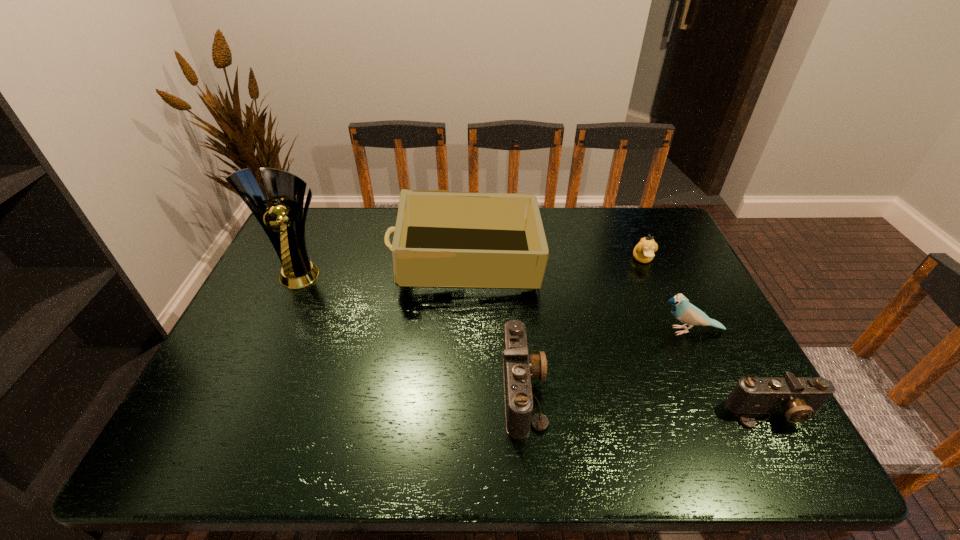
At what (x,y) coordinates should I click in order to perform the action: click on the taller camera. Please return your answer as a coordinate pair (x, y). The width and height of the screenshot is (960, 540). Looking at the image, I should click on (519, 367).

Identify the location of the shorter camera. (799, 399).

Locate an element on the screen. Image resolution: width=960 pixels, height=540 pixels. the second tallest object is located at coordinates (442, 239).

The image size is (960, 540). Identify the location of duckling. (643, 252).

Find the location of a particular element. award is located at coordinates (283, 221).

Locate an element on the screen. The image size is (960, 540). the tallest object is located at coordinates (283, 221).

Locate an element on the screen. The width and height of the screenshot is (960, 540). the third nearest object is located at coordinates pyautogui.click(x=685, y=312).

At what (x,y) coordinates should I click in order to perform the action: click on vacant space situated 0.380m on the front-facing side of the left camera. Please return your answer as a coordinate pair (x, y). This screenshot has width=960, height=540. Looking at the image, I should click on (709, 389).

Locate an element on the screen. The height and width of the screenshot is (540, 960). vacant area situated 0.290m on the right of the box is located at coordinates (635, 262).

Where is `free space located on the face of the duckling`? This screenshot has width=960, height=540. free space located on the face of the duckling is located at coordinates (683, 353).